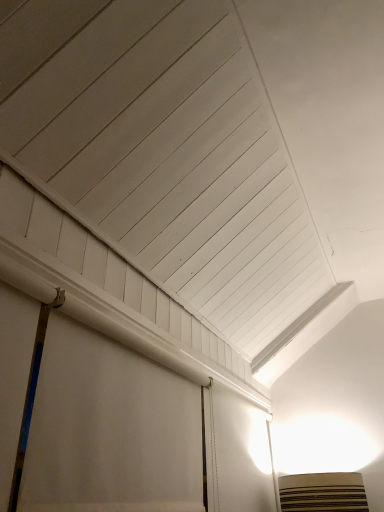
What do you see at coordinates (110, 430) in the screenshot? This screenshot has height=512, width=384. I see `white matte roller blind at center` at bounding box center [110, 430].

I want to click on white matte roller blind at center, so click(x=110, y=430).

The width and height of the screenshot is (384, 512). In order to click on white matte roller blind at center in this screenshot , I will do `click(110, 430)`.